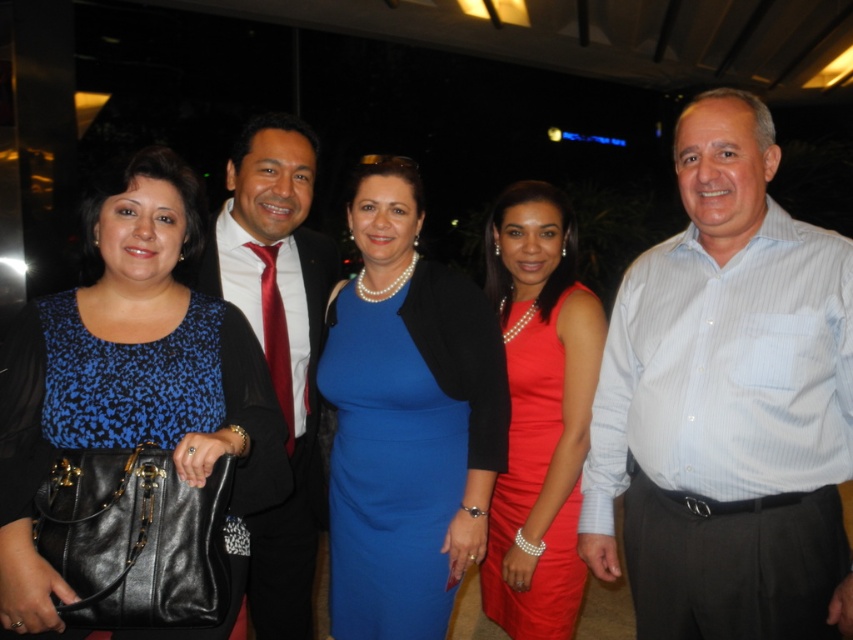
Based on the coordinates provided, which object is located at point (x=132, y=385) in the image?

The point (x=132, y=385) indicates the blue printed blouse at center.